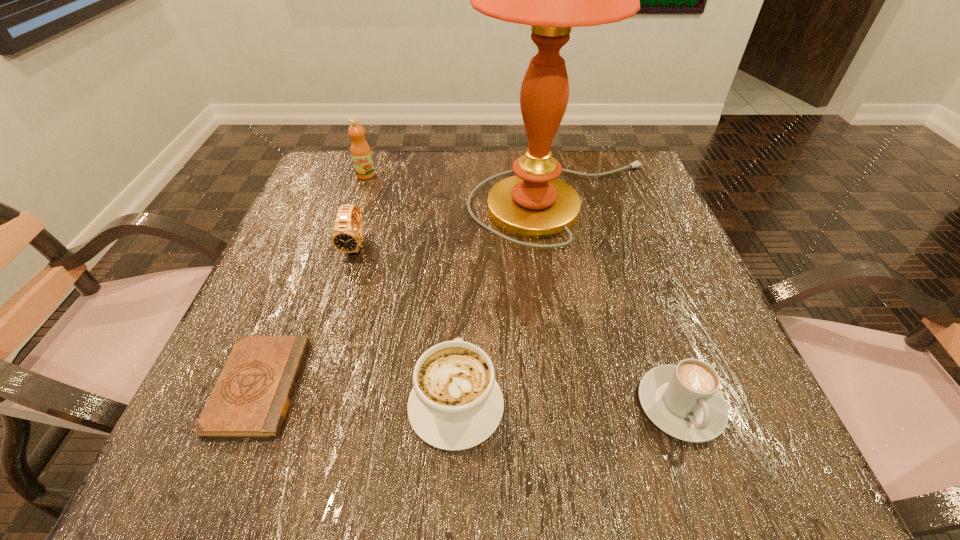
Point out which object is positioned as the third nearest to the second tallest object. Please provide its 2D coordinates. Your answer should be formatted as a tuple, i.e. [(x, y)], where the tuple contains the x and y coordinates of a point satisfying the conditions above.

[(251, 398)]

Locate an element on the screen. object that can be found as the closest to the shortest object is located at coordinates (455, 404).

This screenshot has width=960, height=540. I want to click on free space that satisfies the following two spatial constraints: 1. on the front side of the lamp; 2. on the spine side of the diary, so click(x=605, y=386).

Find the location of a particular element. vacant space that satisfies the following two spatial constraints: 1. on the front label of the second tallest object; 2. on the spine side of the diary is located at coordinates (294, 386).

I want to click on blank space that satisfies the following two spatial constraints: 1. on the front label of the tallest object; 2. on the right side of the second tallest object, so click(x=356, y=202).

Locate an element on the screen. The image size is (960, 540). free space in the image that satisfies the following two spatial constraints: 1. to the right of the left cappuccino's handle; 2. on the right side of the tallest object is located at coordinates (465, 202).

Identify the location of free space that satisfies the following two spatial constraints: 1. on the front label of the tallest object; 2. on the right side of the orange juice. The width and height of the screenshot is (960, 540). [356, 202].

The height and width of the screenshot is (540, 960). Identify the location of vacant area that satisfies the following two spatial constraints: 1. on the front label of the orange juice; 2. on the spine side of the diary. (294, 386).